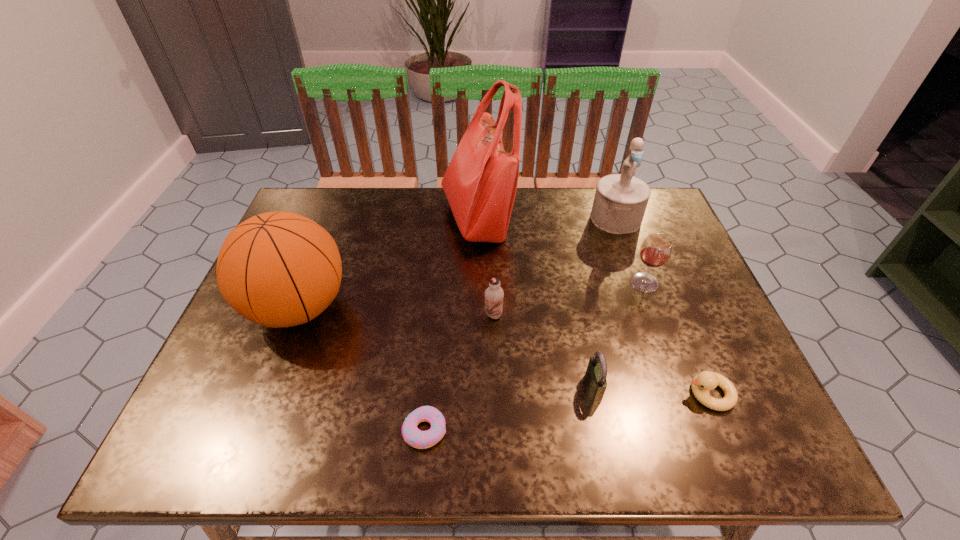
This screenshot has height=540, width=960. In order to click on object located at the near edge in this screenshot , I will do `click(414, 437)`.

You are a GUI agent. You are given a task and a screenshot of the screen. Output one action in this format:
    pyautogui.click(x=<x>, y=<y>)
    Task: Click on the object that is at the left edge
    The image size is (960, 540).
    Given the screenshot: What is the action you would take?
    pyautogui.click(x=279, y=269)

In order to click on figurine that is at the right edge in this screenshot , I will do `click(620, 201)`.

Where is `wineglass situated at the right edge`? This screenshot has height=540, width=960. wineglass situated at the right edge is located at coordinates (656, 249).

The image size is (960, 540). I want to click on duckling at the right edge, so click(x=702, y=383).

The height and width of the screenshot is (540, 960). I want to click on object located in the far right corner section of the desktop, so click(x=620, y=201).

The image size is (960, 540). I want to click on free space at the far edge, so click(440, 214).

In the image, there is a desktop. Where is `free space at the near edge`? free space at the near edge is located at coordinates (640, 441).

Identify the location of free space at the left edge of the desktop. The height and width of the screenshot is (540, 960). (239, 350).

At what (x,y) coordinates should I click in order to perform the action: click on free spot at the right edge of the desktop. Please return your answer as a coordinate pair (x, y). Looking at the image, I should click on (734, 414).